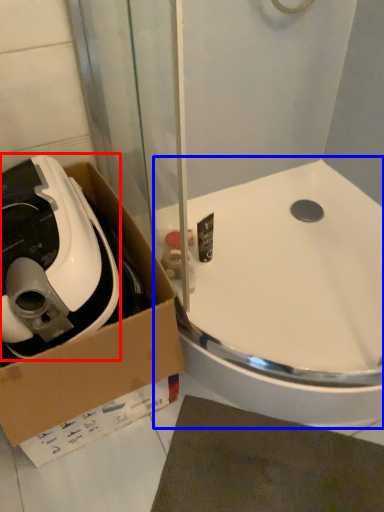
Question: Which point is closer to the camera, appliance (highlighted by a red box) or sink (highlighted by a blue box)?

Choices:
 (A) appliance
 (B) sink

Answer: (A)